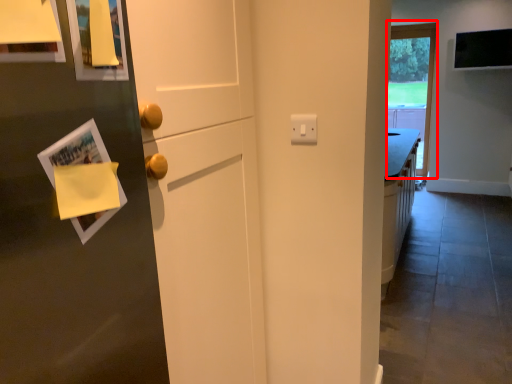
Question: Considering the relative positions of window (annotated by the red box) and magazine in the image provided, where is window (annotated by the red box) located with respect to the staircase?

Choices:
 (A) left
 (B) right

Answer: (B)